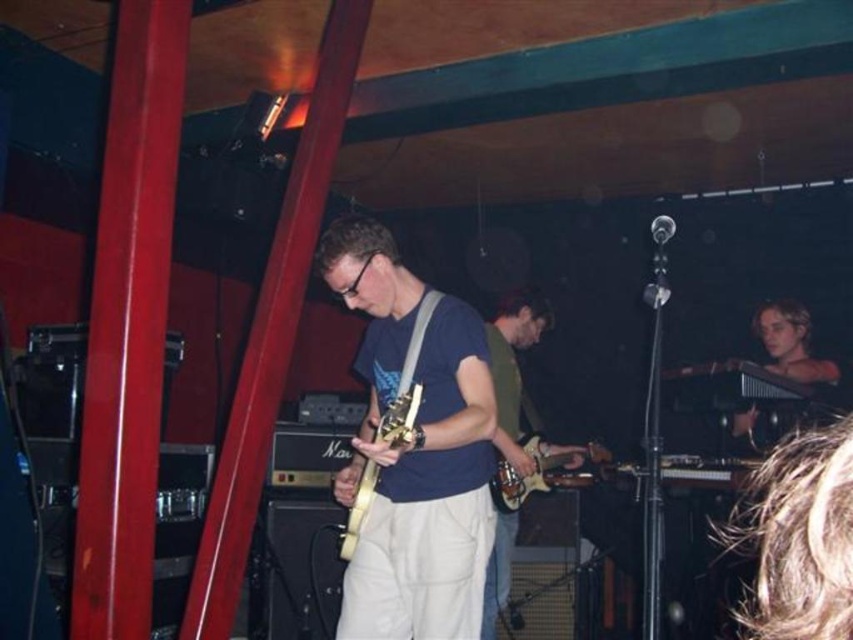
Can you confirm if light brown wooden harp at right is positioned to the left of gold metallic guitar at center?

Incorrect, light brown wooden harp at right is not on the left side of gold metallic guitar at center.

This screenshot has height=640, width=853. What are the coordinates of `light brown wooden harp at right` in the screenshot? It's located at [x=791, y=342].

Who is more forward, (767, 348) or (345, 536)?

Point (345, 536) is in front.

Identify the location of light brown wooden harp at right. This screenshot has height=640, width=853. (791, 342).

Which is above, matte green shirt at center or light brown wooden harp at right?

Positioned higher is light brown wooden harp at right.

Which of these two, matte green shirt at center or light brown wooden harp at right, stands taller?

matte green shirt at center is taller.

Locate an element on the screen. matte green shirt at center is located at coordinates (514, 369).

From the picture: Can you confirm if matte green shirt at center is positioned above gold metallic guitar at center?

No, matte green shirt at center is not above gold metallic guitar at center.

Who is higher up, matte green shirt at center or gold metallic guitar at center?

gold metallic guitar at center

Where is `matte green shirt at center`? matte green shirt at center is located at coordinates (514, 369).